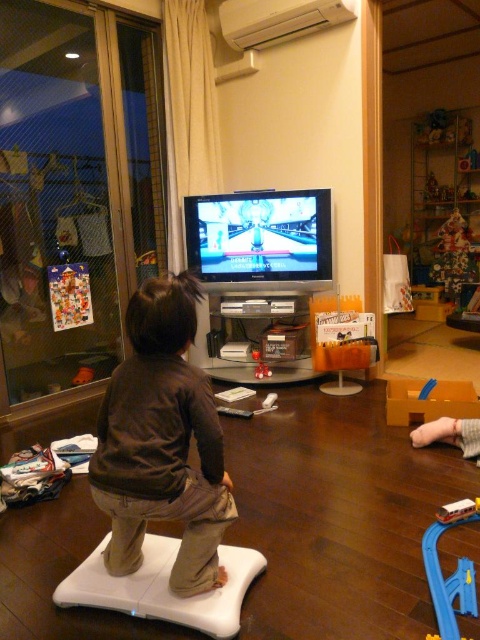
Question: Which point is closer to the camera?

Choices:
 (A) (442, 528)
 (B) (287, 230)
 (C) (208, 550)

Answer: (C)

Question: Estimate the real-world distances between objects in this image. Which object is closer to the smooth plastic train at center?

Choices:
 (A) brown cotton toddler at center
 (B) shiny plastic tv at center

Answer: (A)

Question: Which of the following is the closest to the observer?

Choices:
 (A) (121, 433)
 (B) (235, 209)
 (C) (439, 605)

Answer: (A)

Question: Is brown cotton toddler at center thinner than smooth plastic train at center?

Choices:
 (A) no
 (B) yes

Answer: (A)

Question: Is brown cotton toddler at center below shiny plastic tv at center?

Choices:
 (A) no
 (B) yes

Answer: (B)

Question: Does shiny plastic tv at center lie in front of smooth plastic train at center?

Choices:
 (A) yes
 (B) no

Answer: (B)